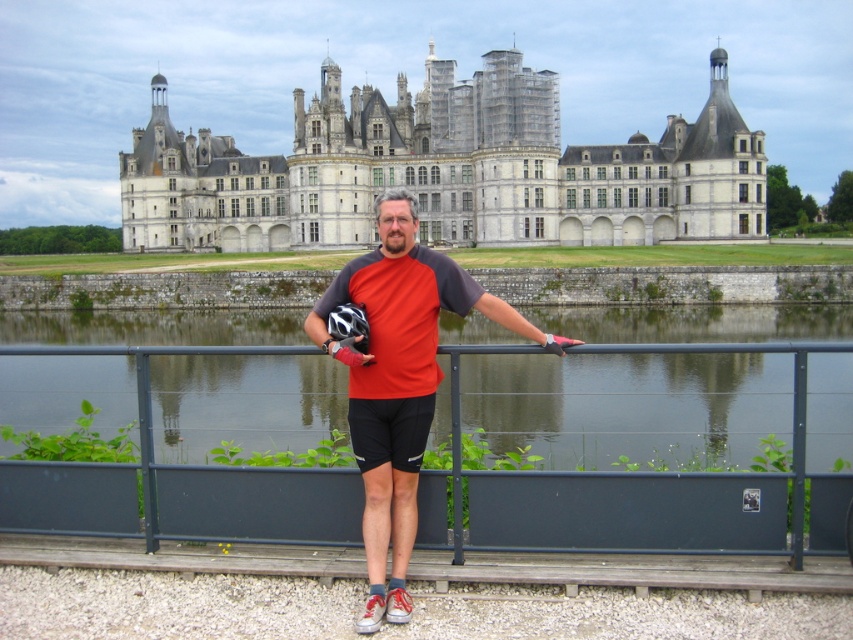
Question: Among these objects, which one is nearest to the camera?

Choices:
 (A) gray stone castle at upper center
 (B) matte red shirt at center
 (C) black synthetic glove at center

Answer: (B)

Question: Which point appears farthest from the camera in this image?

Choices:
 (A) (415, 282)
 (B) (556, 342)

Answer: (A)

Question: Considering the relative positions of gray stone castle at upper center and matte red shirt at center in the image provided, where is gray stone castle at upper center located with respect to matte red shirt at center?

Choices:
 (A) right
 (B) left

Answer: (B)

Question: Is matte red shirt at center to the left of black synthetic glove at center from the viewer's perspective?

Choices:
 (A) yes
 (B) no

Answer: (A)

Question: Which of the following is the closest to the observer?

Choices:
 (A) gray stone castle at upper center
 (B) black synthetic glove at center

Answer: (B)

Question: Is gray stone castle at upper center to the left of matte red shirt at center from the viewer's perspective?

Choices:
 (A) no
 (B) yes

Answer: (B)